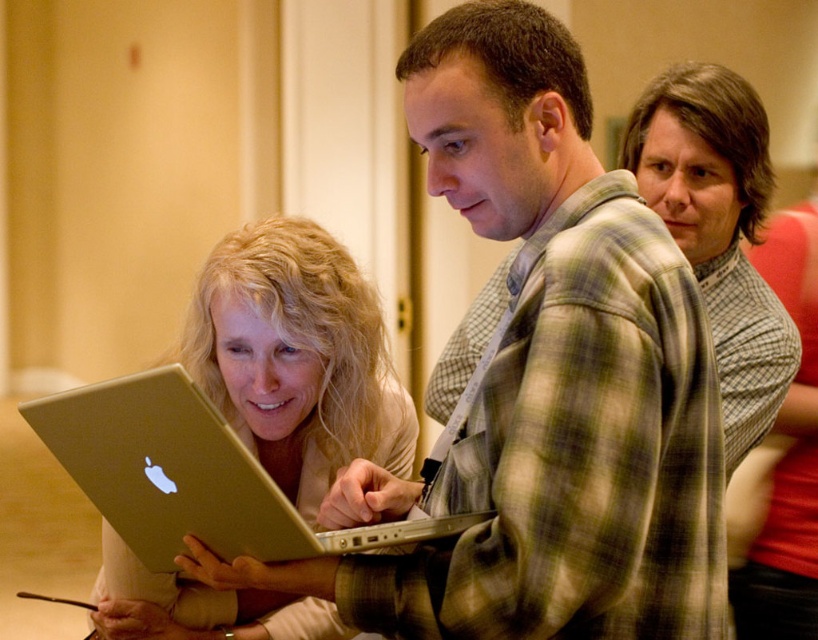
You are observing a group collaborating around a laptop. There are two points on the laptop screen labeled as point A and point B. Point A has coordinates of point (259, 285) and point B has coordinates of point (169, 412). Which point is closer to the viewer?

Point A at (259, 285) is closer to the viewer than point B at (169, 412) because it is further to the viewer according to the description.

You are part of a team working on a project and need to identify which laptop is on the left side. You see the matte gold laptop at center and the silver metallic laptop at center. Which one is located to the left?

The matte gold laptop at center is positioned on the left side of the silver metallic laptop at center, so the matte gold laptop at center is on the left.